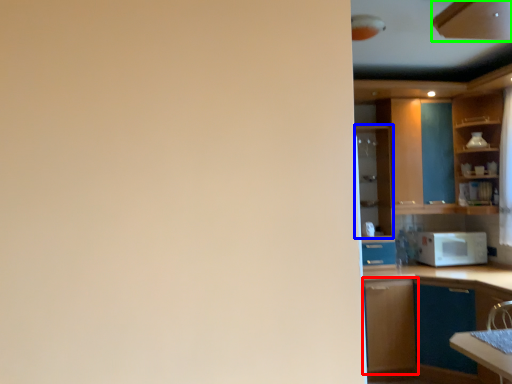
Question: Which object is positioned closest to cabinetry (highlighted by a red box)? Select from cabinetry (highlighted by a blue box) and cabinetry (highlighted by a green box).

Choices:
 (A) cabinetry
 (B) cabinetry

Answer: (A)